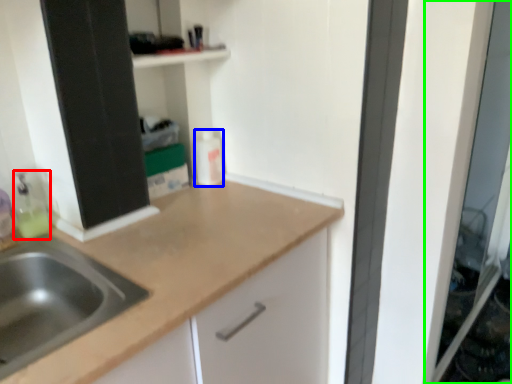
Question: Estimate the real-world distances between objects in this image. Which object is closer to cleaning product (highlighted by a red box), bottle (highlighted by a blue box) or screen door (highlighted by a green box)?

Choices:
 (A) bottle
 (B) screen door

Answer: (A)